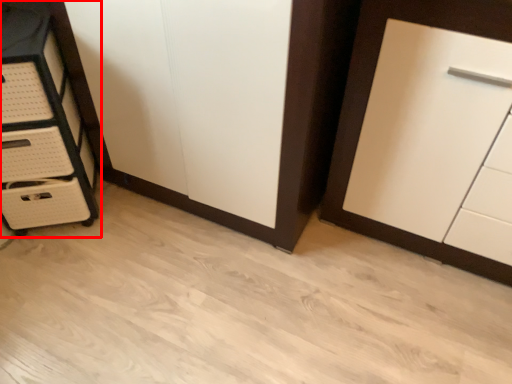
Question: From the image's perspective, where is chest of drawers (annotated by the red box) located relative to cupboard?

Choices:
 (A) below
 (B) above

Answer: (B)